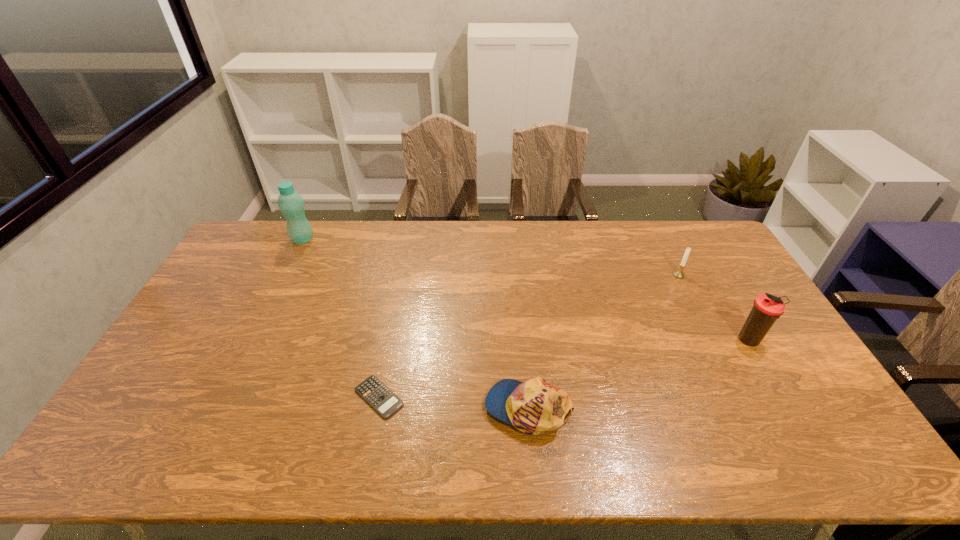
Where is `vacant space that's between the fourth object from right to left and the farthest object`? vacant space that's between the fourth object from right to left and the farthest object is located at coordinates (341, 318).

You are a GUI agent. You are given a task and a screenshot of the screen. Output one action in this format:
    pyautogui.click(x=<x>, y=<y>)
    Task: Click on the blank region between the fourth shortest object and the second object from right to left
    This screenshot has height=540, width=960.
    Given the screenshot: What is the action you would take?
    pyautogui.click(x=714, y=308)

I want to click on vacant space in between the tallest object and the second farthest object, so point(491,257).

This screenshot has height=540, width=960. In order to click on empty location between the candle holder and the thermos bottle in this screenshot , I will do `click(714, 308)`.

You are a GUI agent. You are given a task and a screenshot of the screen. Output one action in this format:
    pyautogui.click(x=<x>, y=<y>)
    Task: Click on the free space between the second farthest object and the third nearest object
    The image size is (960, 540).
    Given the screenshot: What is the action you would take?
    pyautogui.click(x=714, y=308)

At what (x,y) coordinates should I click in order to perform the action: click on free space that is in between the second object from left to right and the tallest object. Please return your answer as a coordinate pair (x, y). Looking at the image, I should click on [341, 318].

You are a GUI agent. You are given a task and a screenshot of the screen. Output one action in this format:
    pyautogui.click(x=<x>, y=<y>)
    Task: Click on the third closest object to the third object from left to right
    This screenshot has height=540, width=960.
    Given the screenshot: What is the action you would take?
    pyautogui.click(x=679, y=273)

The image size is (960, 540). I want to click on object that stands as the third closest to the tallest object, so click(679, 273).

You are a GUI agent. You are given a task and a screenshot of the screen. Output one action in this format:
    pyautogui.click(x=<x>, y=<y>)
    Task: Click on the free space that satisfies the following two spatial constraints: 1. on the front side of the calculator; 2. on the right side of the tallest object
    
    Given the screenshot: What is the action you would take?
    pyautogui.click(x=226, y=397)

The height and width of the screenshot is (540, 960). In order to click on free space in the image that satisfies the following two spatial constraints: 1. on the front side of the second farthest object; 2. on the bill of the cap in this screenshot , I will do `click(746, 408)`.